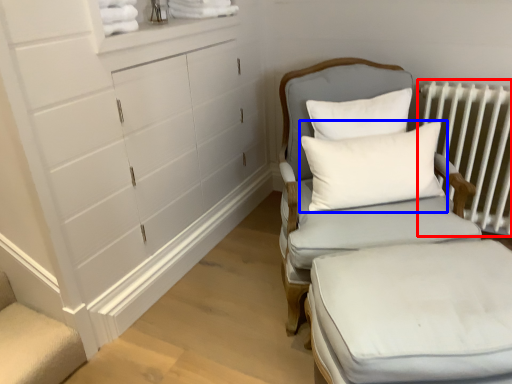
Question: Which point is closer to the camera, radiator (highlighted by a red box) or pillow (highlighted by a blue box)?

Choices:
 (A) radiator
 (B) pillow

Answer: (B)